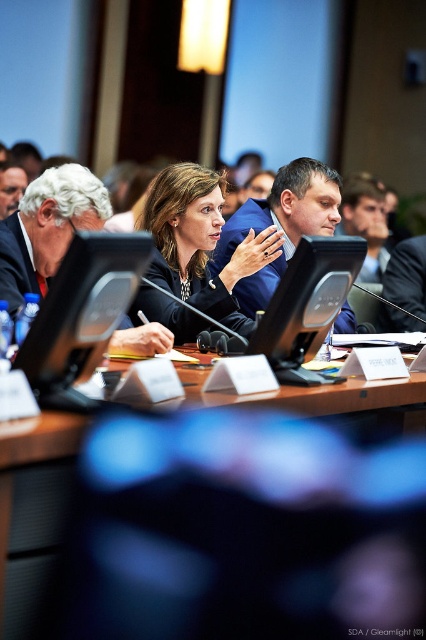
You are a photographer standing in front of the conference table. You need to take a closeup photo of the matte black suit at center without moving any objects. Is the current distance sufficient for a clear closeup shot?

The matte black suit at center is 2.28 meters away from the camera. A typical closeup shot requires the subject to be within 1.5 meters of the camera for clarity. Therefore, the current distance is too far for a clear closeup without moving the camera closer or using a zoom lens.

You are attending a conference and need to place a small plant between the two points labeled point (114, 620) and point (287, 216). Can you determine which point is closer to the front of the table where the speaker is located?

Point (114, 620) is closer to the viewer than point (287, 216), so the front of the table where the speaker is located would be closer to point (114, 620).

You are standing in front of the brown wooden table at center in the conference room. You need to place a 18 inch wide laptop on the table. Can the laptop fit on the table without overlapping the edges?

The distance between the brown wooden table at center and the viewer is 19.05 inches, but this measurement refers to the depth from the viewer to the table, not the table width. The table width isn